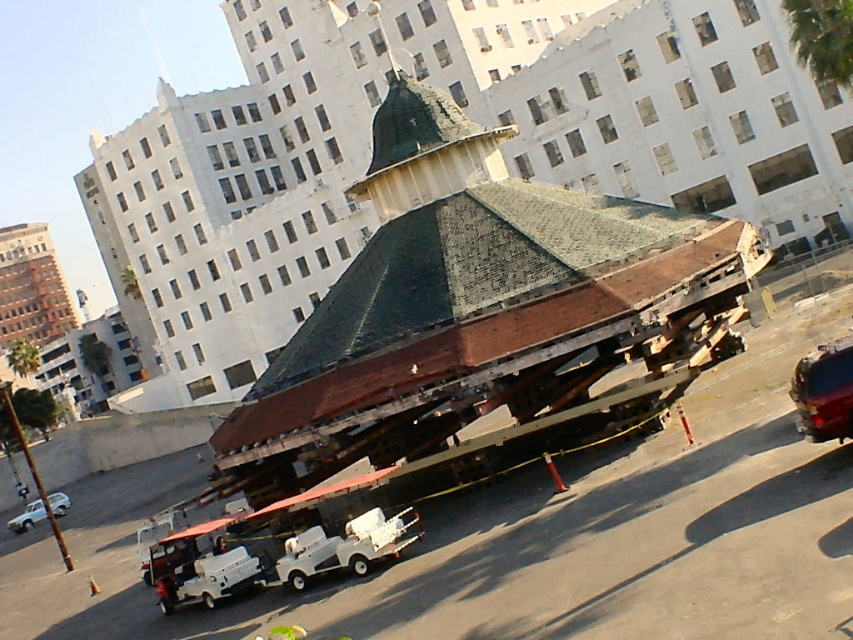
Question: Estimate the real-world distances between objects in this image. Which object is closer to the metallic red suv at right?

Choices:
 (A) rusty metal gazebo at center
 (B) green leafy palm tree at upper right

Answer: (A)

Question: Which of the following is the closest to the observer?

Choices:
 (A) white matte car at lower left
 (B) green leafy palm tree at upper right

Answer: (B)

Question: Is green leafy palm tree at upper right above white matte golf cart at lower left?

Choices:
 (A) yes
 (B) no

Answer: (A)

Question: Is green leafy palm tree at upper right to the left of white matte golf cart at lower left from the viewer's perspective?

Choices:
 (A) no
 (B) yes

Answer: (A)

Question: Does green leafy palm tree at upper right appear over white matte golf cart at lower left?

Choices:
 (A) no
 (B) yes

Answer: (B)

Question: Among these points, which one is farthest from the camera?

Choices:
 (A) (30, 525)
 (B) (277, 374)
 (C) (796, 19)
 (D) (821, 433)

Answer: (A)